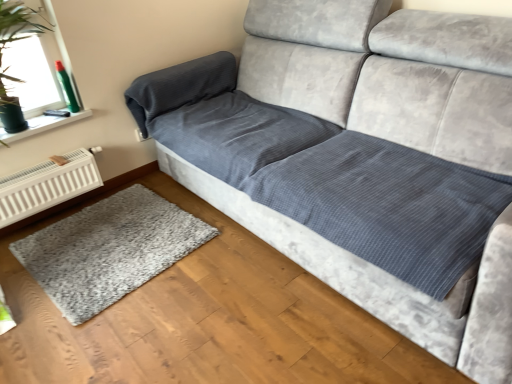
Question: In the image, is white metallic radiator at lower left positioned in front of or behind gray shaggy rug at lower left?

Choices:
 (A) front
 (B) behind

Answer: (B)

Question: Is white metallic radiator at lower left taller or shorter than gray shaggy rug at lower left?

Choices:
 (A) tall
 (B) short

Answer: (A)

Question: Which is nearer to the transparent glass window at upper left?

Choices:
 (A) white metallic radiator at lower left
 (B) gray shaggy rug at lower left

Answer: (A)

Question: Which is nearer to the gray shaggy rug at lower left?

Choices:
 (A) transparent glass window at upper left
 (B) white metallic radiator at lower left

Answer: (B)